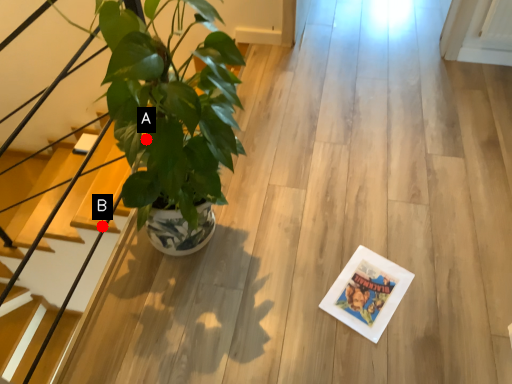
Question: Two points are circled on the image, labeled by A and B beside each circle. Which of the following is the closest to the observer?

Choices:
 (A) A is closer
 (B) B is closer

Answer: (A)